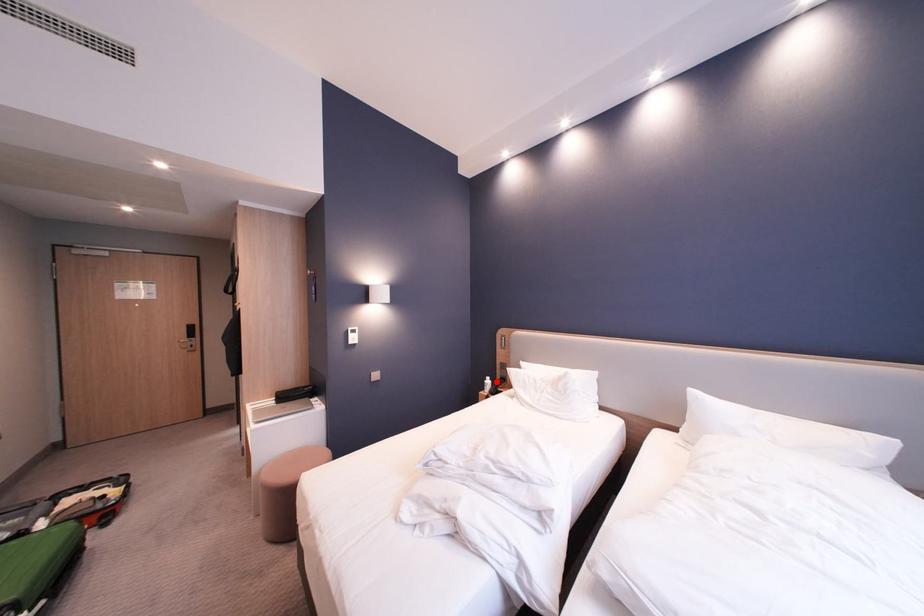
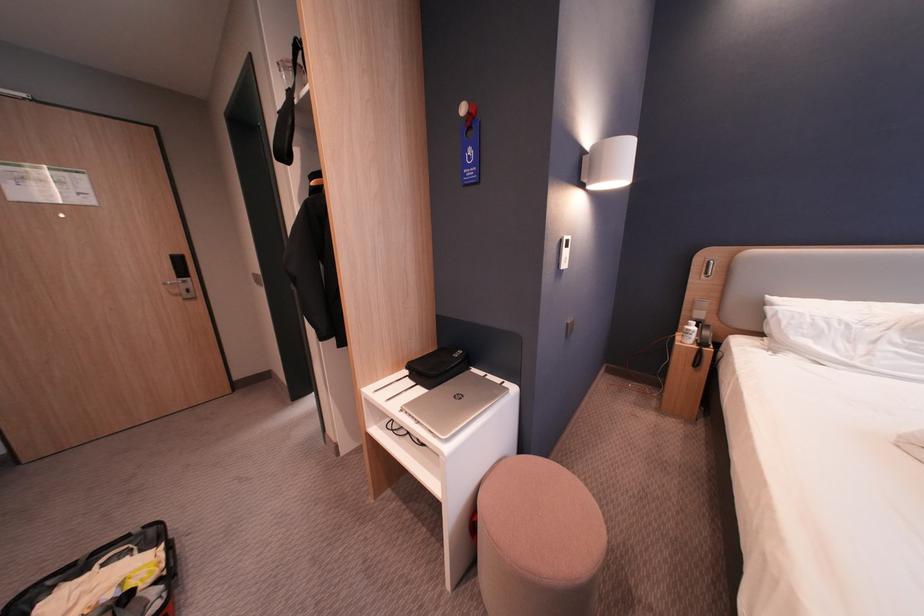
Question: A red point is marked in image1. In image2, is the corresponding 3D point closer to the camera or farther? Reply with the corresponding letter.

Choices:
 (A) The corresponding 3D point is closer.
 (B) The corresponding 3D point is farther.

Answer: (A)